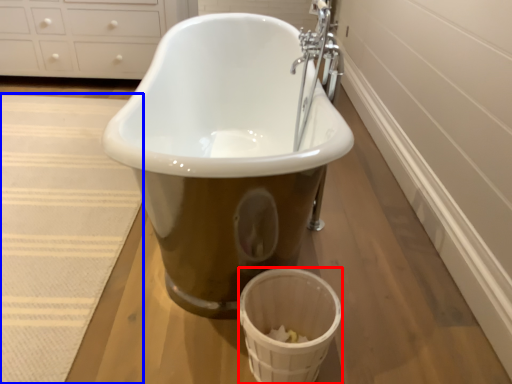
Question: Which object is further to the camera taking this photo, basket (highlighted by a red box) or bath mat (highlighted by a blue box)?

Choices:
 (A) basket
 (B) bath mat

Answer: (B)